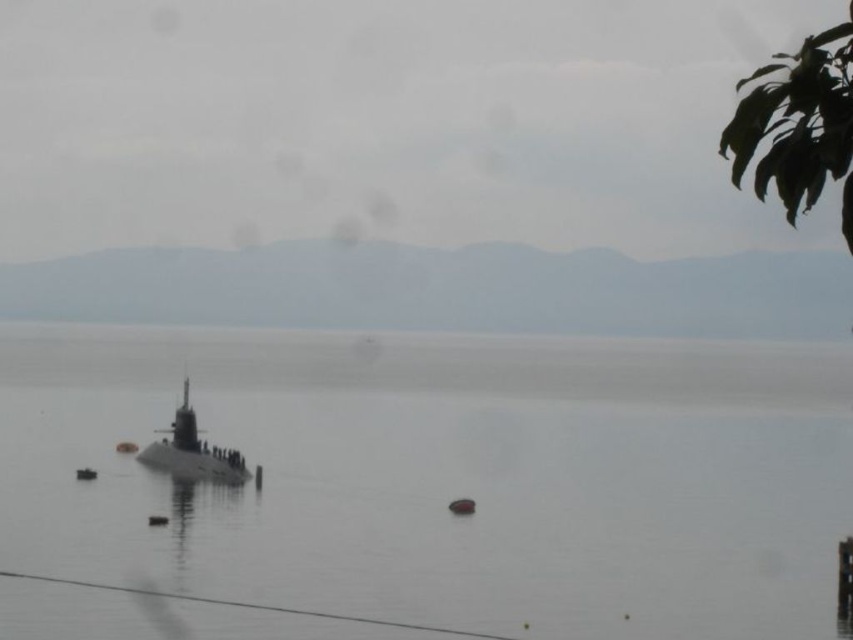
Does point (405, 528) come farther from viewer compared to point (166, 461)?

No, it is in front of (166, 461).

Can you confirm if smooth gray water at center is wider than gray metallic submarine at center?

Yes, smooth gray water at center is wider than gray metallic submarine at center.

Is point (142, 534) closer to camera compared to point (196, 451)?

Yes, point (142, 534) is in front of point (196, 451).

This screenshot has height=640, width=853. I want to click on smooth gray water at center, so click(x=444, y=476).